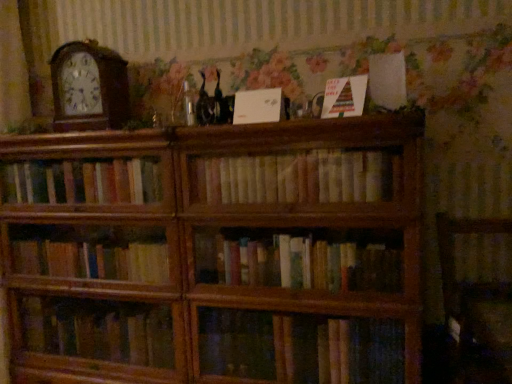
Question: From the image's perspective, is multicolored paper at upper center, arranged as the first paperback book when viewed from the right, located above wooden bookcase at center?

Choices:
 (A) yes
 (B) no

Answer: (A)

Question: Is multicolored paper at upper center, arranged as the first paperback book when viewed from the right, to the left of wooden bookcase at center from the viewer's perspective?

Choices:
 (A) no
 (B) yes

Answer: (A)

Question: From the image's perspective, is multicolored paper at upper center, arranged as the first paperback book when viewed from the right, under wooden bookcase at center?

Choices:
 (A) yes
 (B) no

Answer: (B)

Question: From a real-world perspective, is multicolored paper at upper center, arranged as the first paperback book when viewed from the right, positioned under wooden bookcase at center based on gravity?

Choices:
 (A) yes
 (B) no

Answer: (B)

Question: Is multicolored paper at upper center, marked as the 2th paperback book in a left-to-right arrangement, oriented towards wooden bookcase at center?

Choices:
 (A) no
 (B) yes

Answer: (A)

Question: Relative to wooden clock at left, is wooden armchair at lower right in front or behind?

Choices:
 (A) behind
 (B) front

Answer: (B)

Question: Is wooden armchair at lower right inside or outside of wooden clock at left?

Choices:
 (A) inside
 (B) outside

Answer: (B)

Question: Looking at the image, does wooden armchair at lower right seem bigger or smaller compared to wooden clock at left?

Choices:
 (A) big
 (B) small

Answer: (A)

Question: From a real-world perspective, relative to wooden clock at left, is wooden armchair at lower right vertically above or below?

Choices:
 (A) below
 (B) above

Answer: (A)

Question: From a real-world perspective, is multicolored paper at upper center, marked as the 2th paperback book in a left-to-right arrangement, above or below white matte paper at upper center, which is counted as the 2th paperback book, starting from the right?

Choices:
 (A) above
 (B) below

Answer: (A)

Question: Is multicolored paper at upper center, arranged as the first paperback book when viewed from the right, to the left or to the right of white matte paper at upper center, the first paperback book in the left-to-right sequence, in the image?

Choices:
 (A) right
 (B) left

Answer: (A)

Question: Does point (352, 94) appear closer or farther from the camera than point (242, 92)?

Choices:
 (A) farther
 (B) closer

Answer: (B)

Question: Considering the positions of multicolored paper at upper center, arranged as the first paperback book when viewed from the right, and white matte paper at upper center, which is counted as the 2th paperback book, starting from the right, in the image, is multicolored paper at upper center, arranged as the first paperback book when viewed from the right, wider or thinner than white matte paper at upper center, which is counted as the 2th paperback book, starting from the right,?

Choices:
 (A) wide
 (B) thin

Answer: (A)

Question: Does point coord(96,102) appear closer or farther from the camera than point coord(443,213)?

Choices:
 (A) closer
 (B) farther

Answer: (B)

Question: From the image's perspective, is wooden clock at left positioned above or below wooden armchair at lower right?

Choices:
 (A) below
 (B) above

Answer: (B)